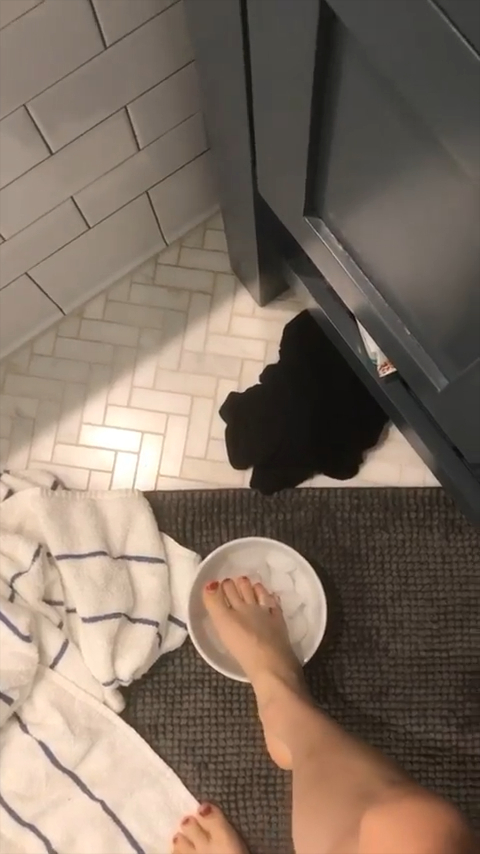
Where is `white floor tile`? white floor tile is located at coordinates (155, 436).